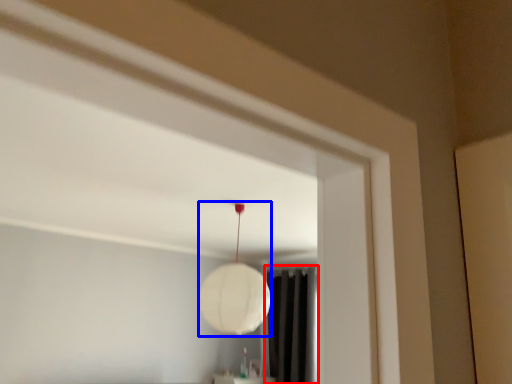
Question: Among these objects, which one is nearest to the camera, curtain (highlighted by a red box) or lamp (highlighted by a blue box)?

Choices:
 (A) curtain
 (B) lamp

Answer: (B)